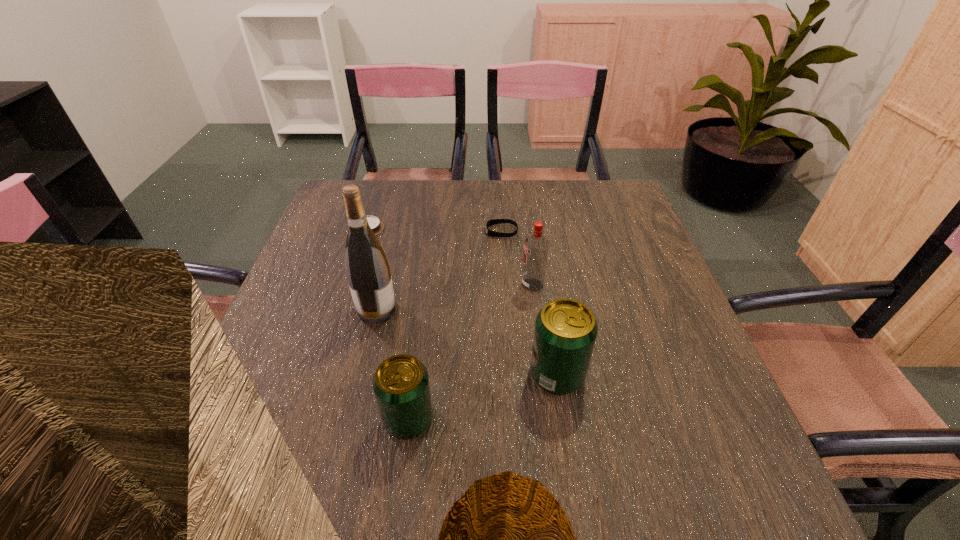
You are a GUI agent. You are given a task and a screenshot of the screen. Output one action in this format:
    pyautogui.click(x=<x>, y=<y>)
    Task: Click on the vacant area that lies between the chocolate cake and the third object from left to right
    The image size is (960, 540).
    Given the screenshot: What is the action you would take?
    pyautogui.click(x=388, y=323)

Where is `free spot between the chocolate cake and the vodka`? Image resolution: width=960 pixels, height=540 pixels. free spot between the chocolate cake and the vodka is located at coordinates (450, 256).

Find the location of a particular element. The height and width of the screenshot is (540, 960). unoccupied area between the wristband and the tallest object is located at coordinates (439, 271).

Identify the location of vacant area between the wristband and the vodka. This screenshot has width=960, height=540. (516, 258).

Where is `empty space that is in between the shorter beer can and the right beer can`? empty space that is in between the shorter beer can and the right beer can is located at coordinates point(483,396).

Where is `object that can be found as the second closest to the chocolate cake`? object that can be found as the second closest to the chocolate cake is located at coordinates (494, 221).

This screenshot has height=540, width=960. In order to click on object that stands as the fourth closest to the fourth object from right to left in this screenshot , I will do `click(494, 221)`.

Image resolution: width=960 pixels, height=540 pixels. Identify the location of free space that satisfies the following two spatial constraints: 1. on the front label of the third farthest object; 2. on the left side of the taller beer can. (543, 374).

Find the location of a particular element. blank space that satisfies the following two spatial constraints: 1. on the display of the right beer can; 2. on the left side of the wristband is located at coordinates (510, 374).

Where is `vacant point that satisfies the following two spatial constraints: 1. on the label of the fourth tallest object; 2. on the right side of the wine bottle`? The width and height of the screenshot is (960, 540). vacant point that satisfies the following two spatial constraints: 1. on the label of the fourth tallest object; 2. on the right side of the wine bottle is located at coordinates (350, 418).